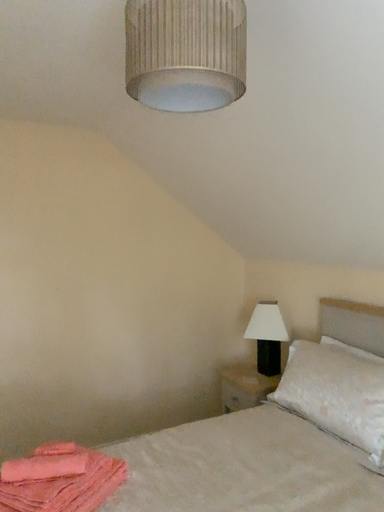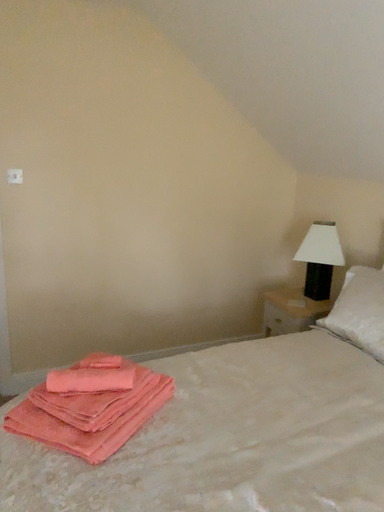
Question: How did the camera likely rotate when shooting the video?

Choices:
 (A) rotated downward
 (B) rotated upward

Answer: (A)